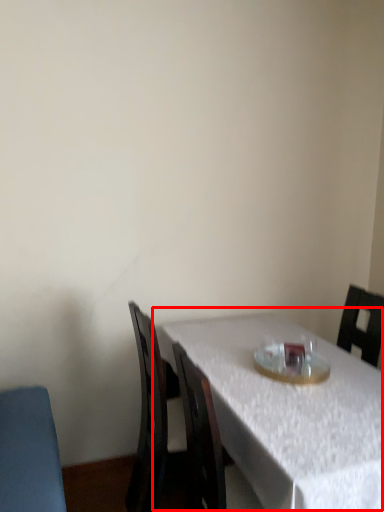
Question: From the image's perspective, what is the correct spatial positioning of table (annotated by the red box) in reference to tableware?

Choices:
 (A) below
 (B) above

Answer: (A)